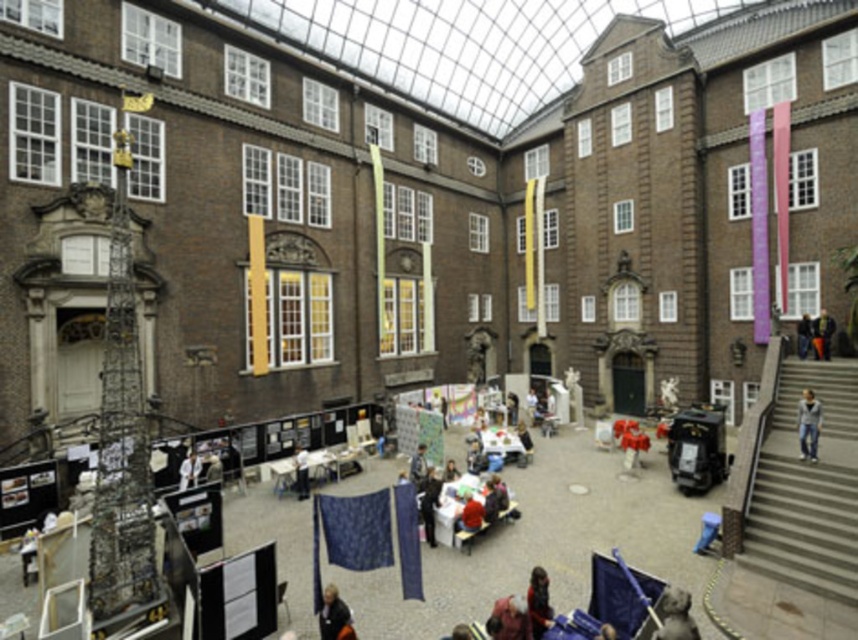
You are standing in the courtyard and want to place a new decorative banner. The banner requires a hook at point (301, 472). What color banner should you hang there?

You should hang a dark blue fabric at center because that is the color and location specified at point (301, 472).

You are standing in the courtyard and want to put your dark brown leather jacket at lower center on a nearby coat rack located to the right of your dark blue jeans at center. Can you place the jacket there?

The dark brown leather jacket at lower center is to the left of dark blue jeans at center, so the coat rack to the right of the dark blue jeans at center would be further to the right. You can place the jacket there by moving it from its current position to the right side of the dark blue jeans at center.